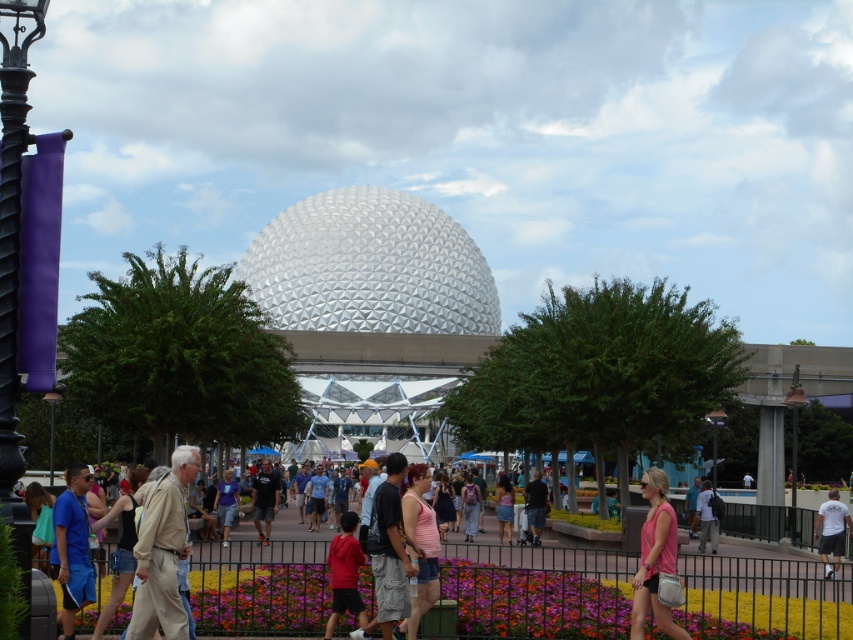
Question: Does metallic silver sphere at center have a larger size compared to white cotton t-shirt at lower right?

Choices:
 (A) no
 (B) yes

Answer: (B)

Question: Among these objects, which one is nearest to the camera?

Choices:
 (A) dark gray fabric shorts at center
 (B) beige fabric jacket at lower left
 (C) blue fabric shorts at lower left
 (D) pink fabric dress at center

Answer: (B)

Question: Among these objects, which one is nearest to the camera?

Choices:
 (A) metallic silver sphere at center
 (B) light blue shirt at center
 (C) pink fabric dress at center

Answer: (C)

Question: Does pink fabric tank top at lower right have a larger size compared to blue fabric shorts at lower left?

Choices:
 (A) yes
 (B) no

Answer: (A)

Question: Can you confirm if purple fabric flower at lower center is positioned above denim shorts at center?

Choices:
 (A) no
 (B) yes

Answer: (A)

Question: Among these objects, which one is farthest from the camera?

Choices:
 (A) pink fabric dress at center
 (B) beige fabric jacket at lower left

Answer: (A)